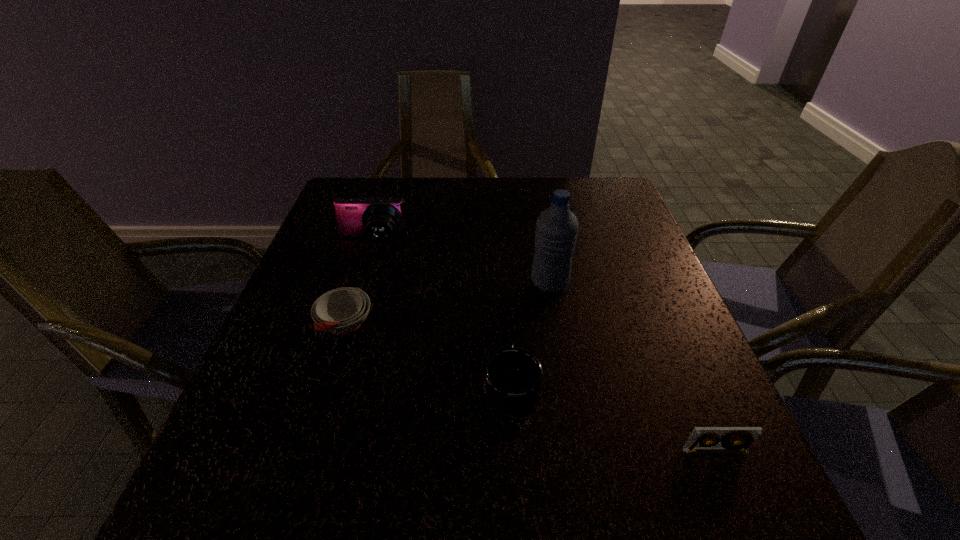
This screenshot has width=960, height=540. What are the coordinates of `free space that is in between the farthest object and the rightmost object` in the screenshot? It's located at (543, 347).

At what (x,y) coordinates should I click in order to perform the action: click on free space between the third farthest object and the fourth farthest object. Please return your answer as a coordinate pair (x, y). Looking at the image, I should click on point(428,355).

You are a GUI agent. You are given a task and a screenshot of the screen. Output one action in this format:
    pyautogui.click(x=<x>, y=<y>)
    Task: Click on the unoccupied area between the soup bowl and the water bottle
    This screenshot has width=960, height=540.
    Given the screenshot: What is the action you would take?
    pyautogui.click(x=447, y=303)

The width and height of the screenshot is (960, 540). I want to click on unoccupied area between the soup bowl and the second tallest object, so click(x=359, y=284).

Choose which object is the nearest neighbor to the second nearest object. Please provide its 2D coordinates. Your answer should be formatted as a tuple, i.e. [(x, y)], where the tuple contains the x and y coordinates of a point satisfying the conditions above.

[(557, 227)]

Identify the location of object that is the closest to the rightmost object. (512, 377).

You are a GUI agent. You are given a task and a screenshot of the screen. Output one action in this format:
    pyautogui.click(x=<x>, y=<y>)
    Task: Click on the blank space that satisfies the following two spatial constraints: 1. on the front-facing side of the farthest object; 2. on the right side of the tallest object
    The width and height of the screenshot is (960, 540).
    Given the screenshot: What is the action you would take?
    pyautogui.click(x=360, y=282)